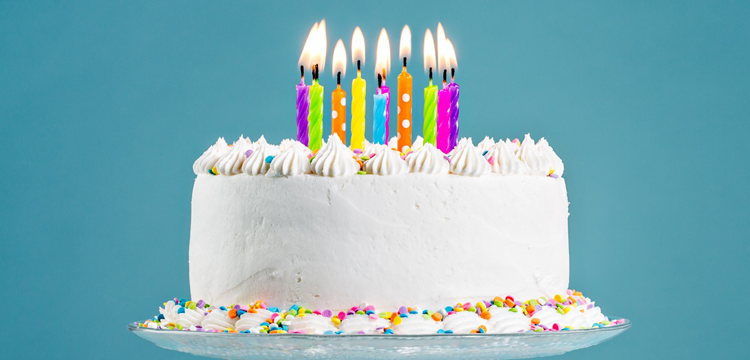
The image size is (750, 360). Identify the location of birthday candles. (301, 92), (316, 123), (338, 117), (361, 121), (380, 122), (390, 87), (405, 102), (428, 121), (450, 125), (457, 119).